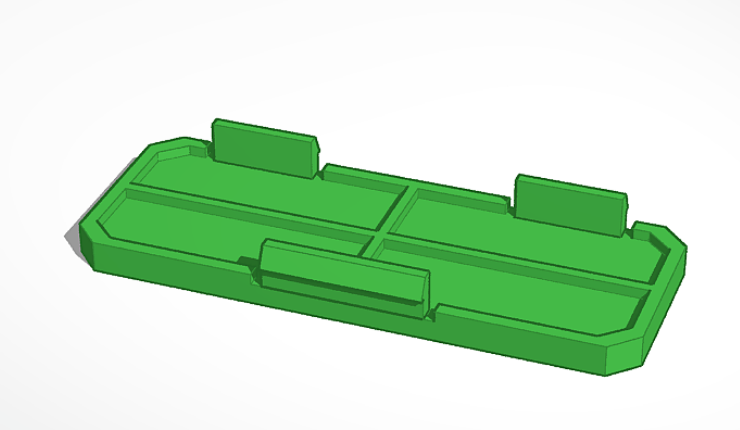
Find the location of `hooks`. hooks is located at coordinates (377, 285), (272, 157), (568, 213).